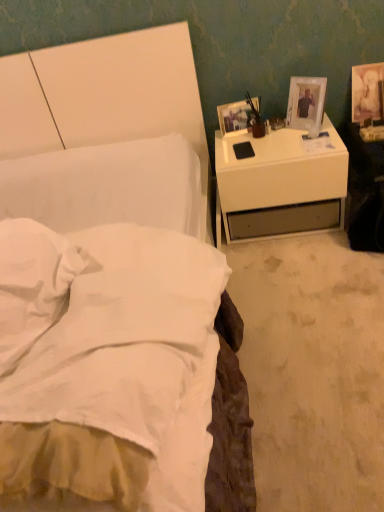
Question: Is matte gold picture frame at upper right, arranged as the third picture frame when viewed from the left, wider or thinner than white plastic picture frame at upper right, acting as the 2th picture frame starting from the right?

Choices:
 (A) thin
 (B) wide

Answer: (A)

Question: Considering the positions of matte gold picture frame at upper right, arranged as the third picture frame when viewed from the left, and white plastic picture frame at upper right, the second picture frame viewed from the left, in the image, is matte gold picture frame at upper right, arranged as the third picture frame when viewed from the left, taller or shorter than white plastic picture frame at upper right, the second picture frame viewed from the left,?

Choices:
 (A) short
 (B) tall

Answer: (B)

Question: Considering the real-world distances, which object is farthest from the matte white picture frame at upper right, the third picture frame from the right?

Choices:
 (A) matte gold picture frame at upper right, the first picture frame when ordered from right to left
 (B) white soft pillow at lower left
 (C) white soft bed at left
 (D) white glossy nightstand at right
 (E) white plastic picture frame at upper right, the second picture frame viewed from the left

Answer: (B)

Question: Considering the real-world distances, which object is closest to the white soft bed at left?

Choices:
 (A) matte gold picture frame at upper right, arranged as the third picture frame when viewed from the left
 (B) white glossy nightstand at right
 (C) white plastic picture frame at upper right, acting as the 2th picture frame starting from the right
 (D) white soft pillow at lower left
 (E) matte white picture frame at upper right, the 1th picture frame positioned from the left

Answer: (D)